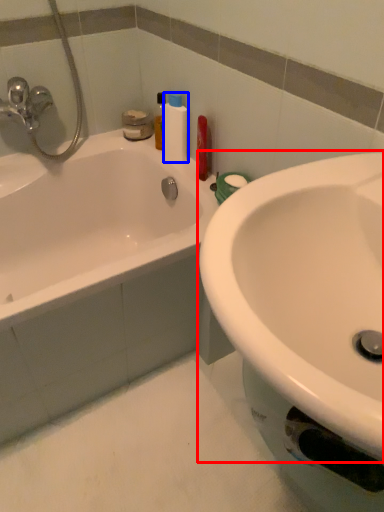
Question: Which object is closer to the camera taking this photo, sink (highlighted by a red box) or cleaning product (highlighted by a blue box)?

Choices:
 (A) sink
 (B) cleaning product

Answer: (A)